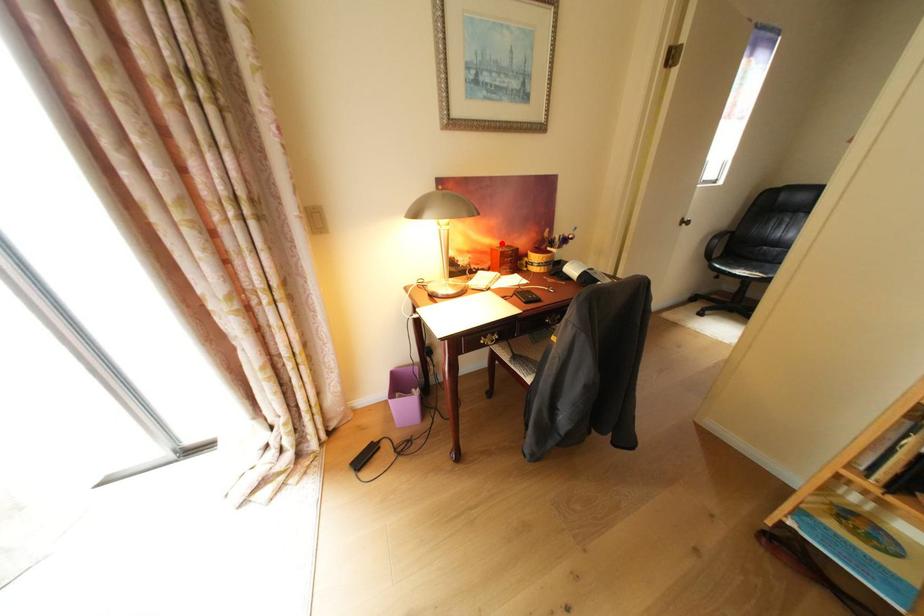
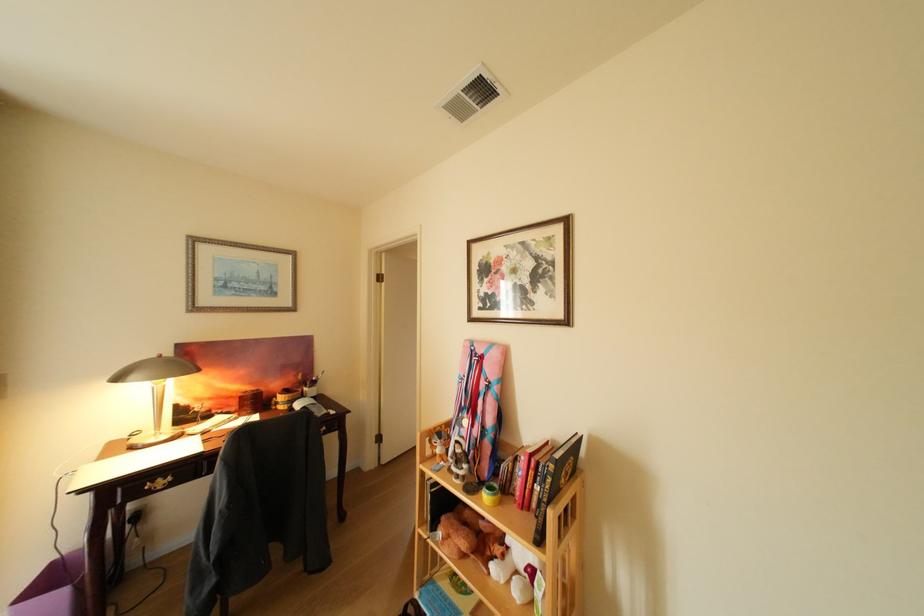
In the second image, find the point that corresponds to the highlighted location in the first image.

(251, 389)